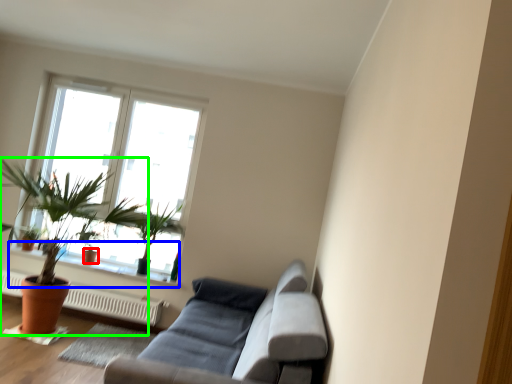
Question: Which object is positioned closest to flowerpot (highlighted by a red box)? Select from window sill (highlighted by a blue box) and houseplant (highlighted by a green box).

Choices:
 (A) window sill
 (B) houseplant

Answer: (A)